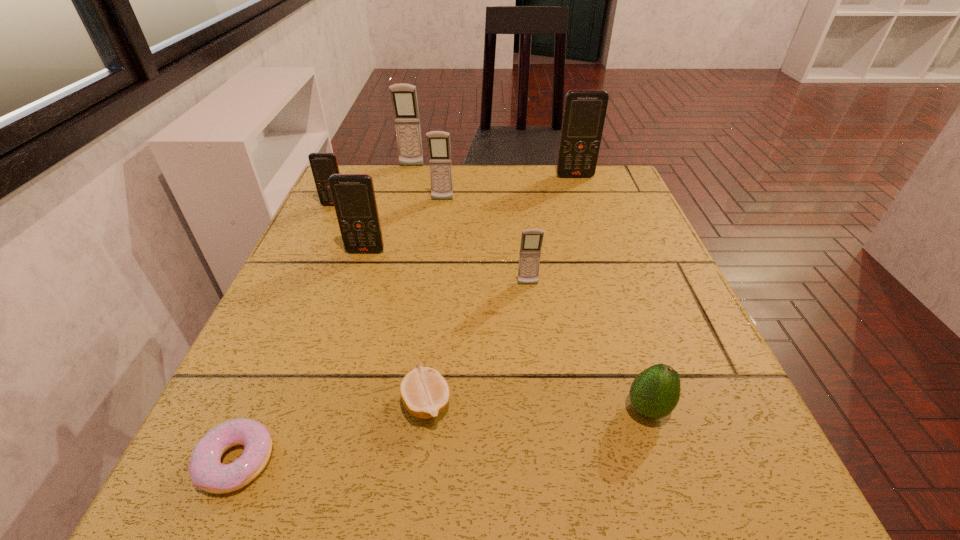
Find the location of a particular element. This screenshot has width=960, height=540. gray cellular telephone that is the closest to the fifth farthest cellular telephone is located at coordinates (438, 142).

This screenshot has height=540, width=960. I want to click on the second closest gray cellular telephone to the nearest orange cellular telephone, so click(x=531, y=240).

At what (x,y) coordinates should I click in order to perform the action: click on orange cellular telephone that is the third closest one to the nearest gray cellular telephone. Please return your answer as a coordinate pair (x, y). The width and height of the screenshot is (960, 540). Looking at the image, I should click on click(323, 165).

You are a GUI agent. You are given a task and a screenshot of the screen. Output one action in this format:
    pyautogui.click(x=<x>, y=<y>)
    Task: Click on the second closest orange cellular telephone relative to the farthest cellular telephone
    The width and height of the screenshot is (960, 540).
    Given the screenshot: What is the action you would take?
    pyautogui.click(x=353, y=195)

In order to click on vacant space that satisfies the following two spatial constraints: 1. on the front-facing side of the second gray cellular telephone from right to left; 2. on the left side of the green avocado in this screenshot , I will do `click(417, 409)`.

Identify the location of vacant space that satisfies the following two spatial constraints: 1. on the screen of the avocado; 2. on the right side of the leftmost orange cellular telephone. (239, 409).

This screenshot has height=540, width=960. I want to click on free spot that satisfies the following two spatial constraints: 1. on the front-facing side of the third farthest cellular telephone; 2. on the right side of the third shortest object, so click(x=417, y=409).

You are a GUI agent. You are given a task and a screenshot of the screen. Output one action in this format:
    pyautogui.click(x=<x>, y=<y>)
    Task: Click on the free space that satisfies the following two spatial constraints: 1. on the front-facing side of the lemon; 2. on the left side of the farthest gray cellular telephone
    This screenshot has width=960, height=540.
    Given the screenshot: What is the action you would take?
    pyautogui.click(x=352, y=403)